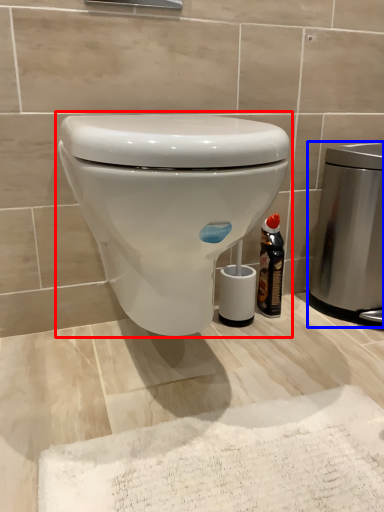
Question: Which object appears closest to the camera in this image, toilet (highlighted by a red box) or appliance (highlighted by a blue box)?

Choices:
 (A) toilet
 (B) appliance

Answer: (A)